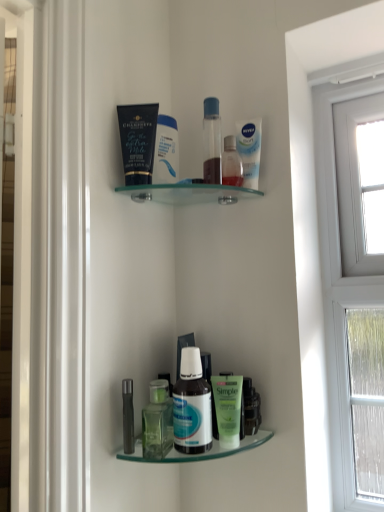
Question: Considering the relative positions of metallic silver tube at lower left, which ranks as the fourth toiletry in top-to-bottom order, and white glossy bottle at lower center, which is the first bottle in right-to-left order, in the image provided, is metallic silver tube at lower left, which ranks as the fourth toiletry in top-to-bottom order, to the right of white glossy bottle at lower center, which is the first bottle in right-to-left order, from the viewer's perspective?

Choices:
 (A) no
 (B) yes

Answer: (A)

Question: Considering the relative sizes of metallic silver tube at lower left, the first toiletry when ordered from left to right, and white glossy bottle at lower center, which ranks as the second bottle in left-to-right order, in the image provided, is metallic silver tube at lower left, the first toiletry when ordered from left to right, taller than white glossy bottle at lower center, which ranks as the second bottle in left-to-right order,?

Choices:
 (A) yes
 (B) no

Answer: (B)

Question: From the image's perspective, is metallic silver tube at lower left, the first toiletry when ordered from left to right, beneath white glossy bottle at lower center, which is the first bottle in right-to-left order?

Choices:
 (A) no
 (B) yes

Answer: (B)

Question: Is metallic silver tube at lower left, which ranks as the fourth toiletry in top-to-bottom order, at the left side of white glossy bottle at lower center, which is the first bottle in right-to-left order?

Choices:
 (A) no
 (B) yes

Answer: (B)

Question: Is metallic silver tube at lower left, the first toiletry when ordered from left to right, touching white glossy bottle at lower center, which is the first bottle in right-to-left order?

Choices:
 (A) no
 (B) yes

Answer: (A)

Question: Which is correct: metallic silver tube at lower left, which is the 1th toiletry from bottom to top, is inside green matte lotion at lower center, the 2th toiletry from the right, or outside of it?

Choices:
 (A) outside
 (B) inside

Answer: (A)

Question: Is point (122, 388) positioned closer to the camera than point (236, 378)?

Choices:
 (A) closer
 (B) farther

Answer: (A)

Question: Considering their positions, is metallic silver tube at lower left, the first toiletry when ordered from left to right, located in front of or behind green matte lotion at lower center, which is counted as the 2th toiletry, starting from the bottom?

Choices:
 (A) front
 (B) behind

Answer: (A)

Question: Looking at their shapes, would you say metallic silver tube at lower left, the first toiletry when ordered from left to right, is wider or thinner than green matte lotion at lower center, the 2th toiletry from the right?

Choices:
 (A) wide
 (B) thin

Answer: (B)

Question: Is translucent plastic bottle at upper center, the 3th toiletry ordered from the bottom, bigger or smaller than transparent plastic bottle at upper center, the 4th toiletry in the bottom-to-top sequence?

Choices:
 (A) big
 (B) small

Answer: (B)

Question: Looking at their shapes, would you say translucent plastic bottle at upper center, which is the 4th toiletry in left-to-right order, is wider or thinner than transparent plastic bottle at upper center, the 1th toiletry viewed from the top?

Choices:
 (A) wide
 (B) thin

Answer: (A)

Question: Considering their positions, is translucent plastic bottle at upper center, which appears as the 1th toiletry when viewed from the right, located in front of or behind transparent plastic bottle at upper center, the 1th toiletry viewed from the top?

Choices:
 (A) front
 (B) behind

Answer: (B)

Question: From the image's perspective, is translucent plastic bottle at upper center, the 3th toiletry ordered from the bottom, above or below transparent plastic bottle at upper center, the second toiletry when ordered from left to right?

Choices:
 (A) below
 (B) above

Answer: (A)

Question: Would you say matte black tube at upper center is inside or outside translucent plastic bottle at upper center, the 3th toiletry ordered from the bottom?

Choices:
 (A) inside
 (B) outside

Answer: (B)

Question: Looking at their shapes, would you say matte black tube at upper center is wider or thinner than translucent plastic bottle at upper center, which is the 4th toiletry in left-to-right order?

Choices:
 (A) wide
 (B) thin

Answer: (B)